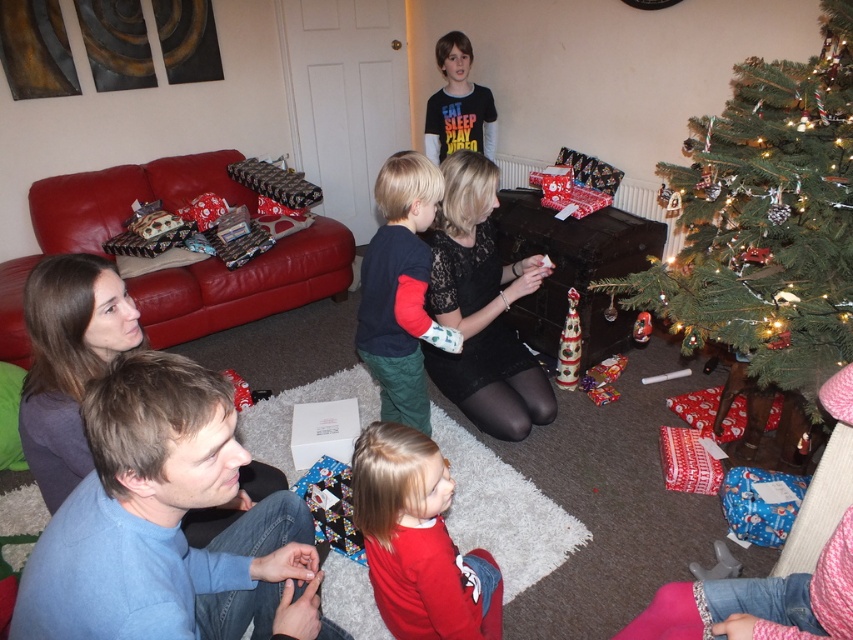
Does matte red shirt at lower center have a greater width compared to black matte shirt at upper center?

In fact, matte red shirt at lower center might be narrower than black matte shirt at upper center.

Based on the photo, is matte red shirt at lower center shorter than black matte shirt at upper center?

Yes.

Between point (397, 532) and point (440, 152), which one is positioned in front?

Point (397, 532) is more forward.

This screenshot has width=853, height=640. Find the location of `matte red shirt at lower center`. matte red shirt at lower center is located at coordinates (418, 540).

Is green textured christmas tree at right closer to camera compared to black matte shirt at upper center?

Yes.

Find the location of a particular element. The height and width of the screenshot is (640, 853). green textured christmas tree at right is located at coordinates (766, 220).

Who is more forward, (755, 195) or (418, 264)?

Positioned in front is point (418, 264).

The image size is (853, 640). What do you see at coordinates (766, 220) in the screenshot?
I see `green textured christmas tree at right` at bounding box center [766, 220].

Does point (821, 182) lie in front of point (409, 180)?

Yes, point (821, 182) is closer to viewer.

Where is `green textured christmas tree at right`? This screenshot has width=853, height=640. green textured christmas tree at right is located at coordinates (766, 220).